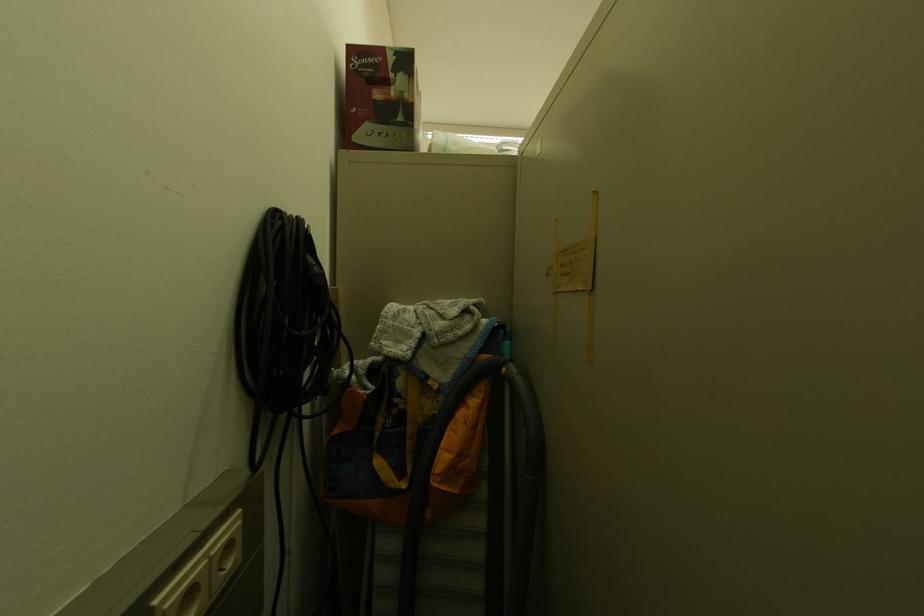
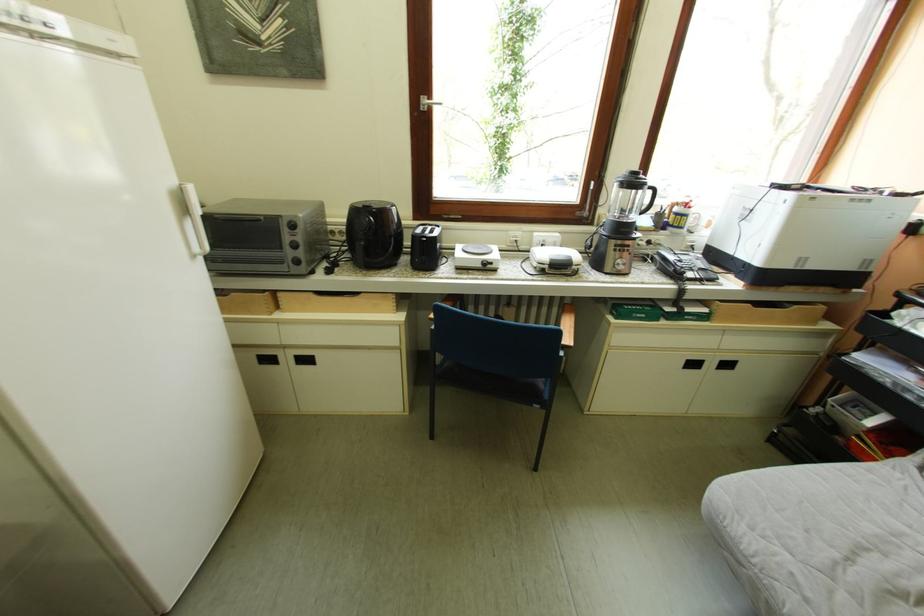
Question: The images are taken continuously from a first-person perspective. In which direction are you moving?

Choices:
 (A) Left
 (B) Right
 (C) Forward
 (D) Backward

Answer: (C)